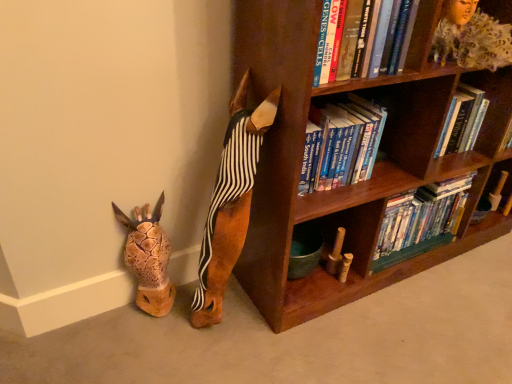
The image size is (512, 384). I want to click on vacant space to the right of brown wooden dog at center, placed as the first animal when sorted from right to left, so click(x=277, y=330).